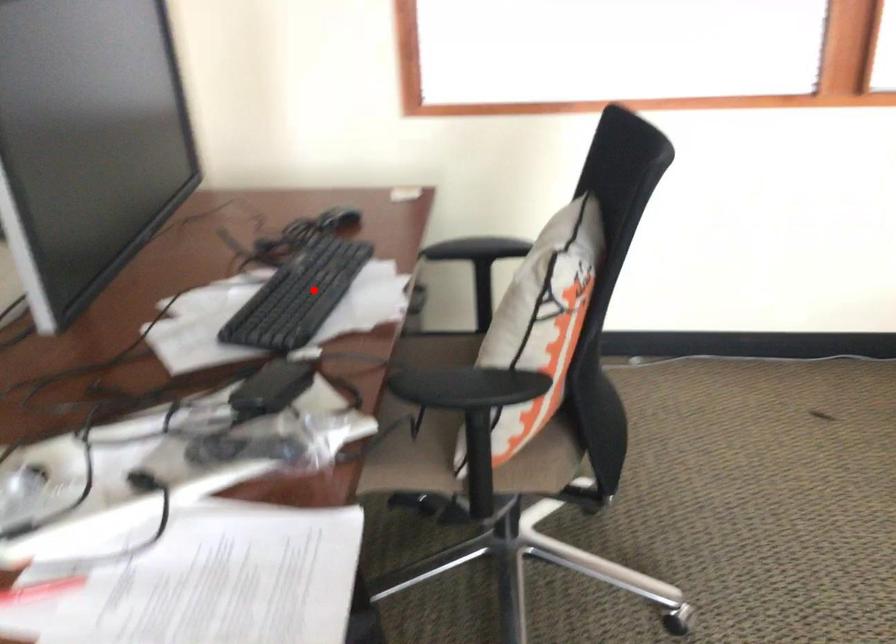
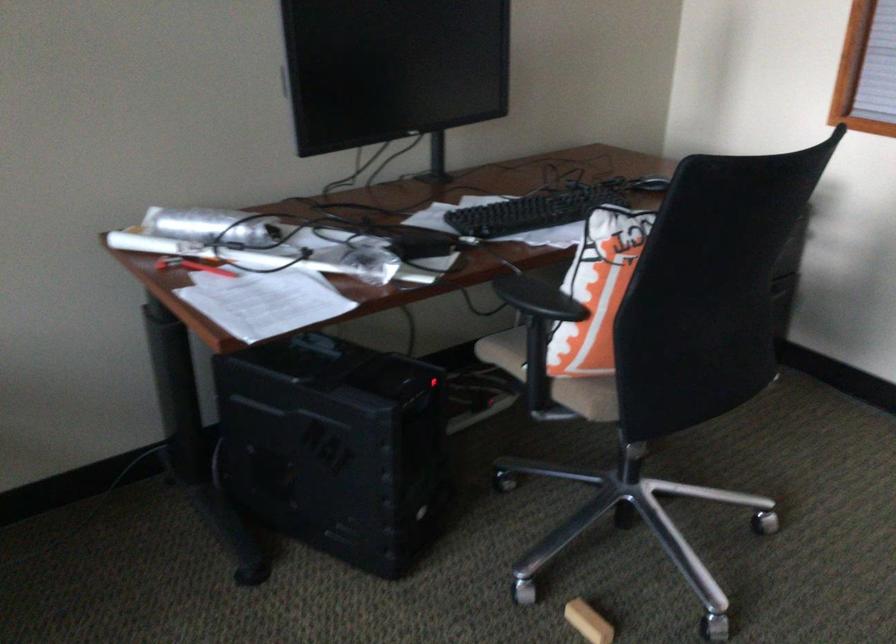
Where in the second image is the point corresponding to the highlighted location from the first image?

(532, 211)